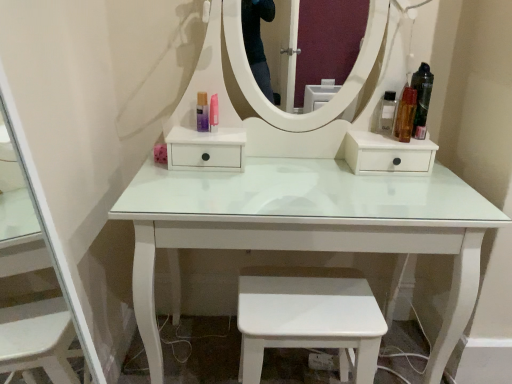
Where is `shiny black hair spray at upper right, which ranks as the 1th toiletry in right-to-left order`? The image size is (512, 384). shiny black hair spray at upper right, which ranks as the 1th toiletry in right-to-left order is located at coordinates (422, 99).

Where is `translucent purple bottle at center, arranged as the 5th toiletry when viewed from the right`? The width and height of the screenshot is (512, 384). translucent purple bottle at center, arranged as the 5th toiletry when viewed from the right is located at coordinates (202, 112).

Find the location of `shiny black hair spray at upper right, which is the 5th toiletry in left-to-right order`. shiny black hair spray at upper right, which is the 5th toiletry in left-to-right order is located at coordinates point(422,99).

Are translucent amber bottle at right, which appears as the 4th toiletry when viewed from the left, and translucent purple bottle at center, arranged as the 5th toiletry when viewed from the right, far apart?

No, translucent amber bottle at right, which appears as the 4th toiletry when viewed from the left, is in close proximity to translucent purple bottle at center, arranged as the 5th toiletry when viewed from the right.

From a real-world perspective, starting from the translucent amber bottle at right, the 2th toiletry viewed from the right, which toiletry is the 2nd one below it? Please provide its 2D coordinates.

[(202, 112)]

Is translucent purple bottle at center, arranged as the first toiletry when viewed from the left, a part of translucent amber bottle at right, which appears as the 4th toiletry when viewed from the left?

That's incorrect, translucent purple bottle at center, arranged as the first toiletry when viewed from the left, is not inside translucent amber bottle at right, which appears as the 4th toiletry when viewed from the left.

Consider the image. Considering the sizes of objects shiny black hair spray at upper right, which ranks as the 1th toiletry in right-to-left order, and translucent purple bottle at center, arranged as the first toiletry when viewed from the left, in the image provided, who is thinner, shiny black hair spray at upper right, which ranks as the 1th toiletry in right-to-left order, or translucent purple bottle at center, arranged as the first toiletry when viewed from the left,?

translucent purple bottle at center, arranged as the first toiletry when viewed from the left, is thinner.

Considering the points (430, 78) and (198, 109), which point is in front, point (430, 78) or point (198, 109)?

Point (430, 78)

Is shiny black hair spray at upper right, which is the 5th toiletry in left-to-right order, taller than translucent purple bottle at center, arranged as the 5th toiletry when viewed from the right?

Indeed, shiny black hair spray at upper right, which is the 5th toiletry in left-to-right order, has a greater height compared to translucent purple bottle at center, arranged as the 5th toiletry when viewed from the right.

Considering the relative positions of shiny black hair spray at upper right, which ranks as the 1th toiletry in right-to-left order, and translucent purple bottle at center, arranged as the first toiletry when viewed from the left, in the image provided, is shiny black hair spray at upper right, which ranks as the 1th toiletry in right-to-left order, in front of translucent purple bottle at center, arranged as the first toiletry when viewed from the left,?

Yes.

Is satin silver spray can at right, the 3th toiletry when ordered from right to left, not close to pink glossy lipstick at center, which is counted as the 2th toiletry, starting from the left?

No, satin silver spray can at right, the 3th toiletry when ordered from right to left, is not far away from pink glossy lipstick at center, which is counted as the 2th toiletry, starting from the left.

Considering the points (386, 98) and (211, 118), which point is in front, point (386, 98) or point (211, 118)?

The point (211, 118) is closer.

From the image's perspective, which one is positioned higher, satin silver spray can at right, which appears as the third toiletry when viewed from the left, or pink glossy lipstick at center, which is the fourth toiletry in right-to-left order?

satin silver spray can at right, which appears as the third toiletry when viewed from the left, is shown above in the image.

Can you tell me how much satin silver spray can at right, which appears as the third toiletry when viewed from the left, and pink glossy lipstick at center, which is counted as the 2th toiletry, starting from the left, differ in facing direction?

satin silver spray can at right, which appears as the third toiletry when viewed from the left, and pink glossy lipstick at center, which is counted as the 2th toiletry, starting from the left, are facing 0.000184 degrees away from each other.

Between translucent purple bottle at center, arranged as the first toiletry when viewed from the left, and satin silver spray can at right, the 3th toiletry when ordered from right to left, which one has less height?

Standing shorter between the two is translucent purple bottle at center, arranged as the first toiletry when viewed from the left.

Visually, is translucent purple bottle at center, arranged as the 5th toiletry when viewed from the right, positioned to the left or to the right of satin silver spray can at right, the 3th toiletry when ordered from right to left?

In the image, translucent purple bottle at center, arranged as the 5th toiletry when viewed from the right, appears on the left side of satin silver spray can at right, the 3th toiletry when ordered from right to left.

From the picture: Is translucent purple bottle at center, arranged as the first toiletry when viewed from the left, oriented away from satin silver spray can at right, the 3th toiletry when ordered from right to left?

translucent purple bottle at center, arranged as the first toiletry when viewed from the left, does not have its back to satin silver spray can at right, the 3th toiletry when ordered from right to left.

This screenshot has height=384, width=512. Find the location of `the 1st toiletry positioned below the satin silver spray can at right, the 3th toiletry when ordered from right to left (from a real-world perspective)`. the 1st toiletry positioned below the satin silver spray can at right, the 3th toiletry when ordered from right to left (from a real-world perspective) is located at coordinates (202, 112).

In the image, is pink glossy lipstick at center, which is counted as the 2th toiletry, starting from the left, positioned in front of or behind translucent amber bottle at right, the 2th toiletry viewed from the right?

pink glossy lipstick at center, which is counted as the 2th toiletry, starting from the left, is positioned farther from the viewer than translucent amber bottle at right, the 2th toiletry viewed from the right.

Consider the image. How many degrees apart are the facing directions of pink glossy lipstick at center, which is counted as the 2th toiletry, starting from the left, and translucent amber bottle at right, which appears as the 4th toiletry when viewed from the left?

The facing directions of pink glossy lipstick at center, which is counted as the 2th toiletry, starting from the left, and translucent amber bottle at right, which appears as the 4th toiletry when viewed from the left, are 0.00157 degrees apart.

From the image's perspective, between pink glossy lipstick at center, which is counted as the 2th toiletry, starting from the left, and translucent amber bottle at right, which appears as the 4th toiletry when viewed from the left, which one is located above?

pink glossy lipstick at center, which is counted as the 2th toiletry, starting from the left, from the image's perspective.

Is point (215, 111) behind point (411, 110)?

Yes, point (215, 111) is behind point (411, 110).

In the image, there is a translucent purple bottle at center, arranged as the 5th toiletry when viewed from the right. Identify the location of toiletry below it (from a real-world perspective). Image resolution: width=512 pixels, height=384 pixels. (214, 113).

Considering the sizes of pink glossy lipstick at center, which is counted as the 2th toiletry, starting from the left, and translucent purple bottle at center, arranged as the first toiletry when viewed from the left, in the image, is pink glossy lipstick at center, which is counted as the 2th toiletry, starting from the left, bigger or smaller than translucent purple bottle at center, arranged as the first toiletry when viewed from the left,?

Considering their sizes, pink glossy lipstick at center, which is counted as the 2th toiletry, starting from the left, takes up less space than translucent purple bottle at center, arranged as the first toiletry when viewed from the left.

Is pink glossy lipstick at center, which is the fourth toiletry in right-to-left order, far from translucent purple bottle at center, arranged as the first toiletry when viewed from the left?

pink glossy lipstick at center, which is the fourth toiletry in right-to-left order, is actually quite close to translucent purple bottle at center, arranged as the first toiletry when viewed from the left.

Which is further, (x=209, y=115) or (x=203, y=99)?

The point (x=203, y=99) is more distant.

Measure the distance between shiny black hair spray at upper right, which ranks as the 1th toiletry in right-to-left order, and satin silver spray can at right, the 3th toiletry when ordered from right to left.

shiny black hair spray at upper right, which ranks as the 1th toiletry in right-to-left order, is 10.50 centimeters away from satin silver spray can at right, the 3th toiletry when ordered from right to left.

Considering the sizes of objects shiny black hair spray at upper right, which is the 5th toiletry in left-to-right order, and satin silver spray can at right, the 3th toiletry when ordered from right to left, in the image provided, who is taller, shiny black hair spray at upper right, which is the 5th toiletry in left-to-right order, or satin silver spray can at right, the 3th toiletry when ordered from right to left,?

With more height is shiny black hair spray at upper right, which is the 5th toiletry in left-to-right order.

Identify the location of the 2nd toiletry directly beneath the shiny black hair spray at upper right, which is the 5th toiletry in left-to-right order (from a real-world perspective). This screenshot has width=512, height=384. click(388, 112).

The width and height of the screenshot is (512, 384). I want to click on the 3rd toiletry to the left of the translucent amber bottle at right, the 2th toiletry viewed from the right, counting from the anchor's position, so (x=202, y=112).

At what (x,y) coordinates should I click in order to perform the action: click on the 2nd toiletry in front of the translucent purple bottle at center, arranged as the first toiletry when viewed from the left. Please return your answer as a coordinate pair (x, y). Looking at the image, I should click on (422, 99).

When comparing their distances from translucent purple bottle at center, arranged as the 5th toiletry when viewed from the right, does white glossy step stool at lower center or pink glossy lipstick at center, which is the fourth toiletry in right-to-left order, seem further?

white glossy step stool at lower center is further to translucent purple bottle at center, arranged as the 5th toiletry when viewed from the right.

From the image, which object appears to be farther from translucent amber bottle at right, the 2th toiletry viewed from the right, white glossy step stool at lower center or shiny black hair spray at upper right, which is the 5th toiletry in left-to-right order?

Based on the image, white glossy step stool at lower center appears to be further to translucent amber bottle at right, the 2th toiletry viewed from the right.

From the image, which object appears to be farther from pink glossy lipstick at center, which is the fourth toiletry in right-to-left order, translucent purple bottle at center, arranged as the first toiletry when viewed from the left, or shiny black hair spray at upper right, which ranks as the 1th toiletry in right-to-left order?

shiny black hair spray at upper right, which ranks as the 1th toiletry in right-to-left order, is positioned further to the anchor pink glossy lipstick at center, which is the fourth toiletry in right-to-left order.

From the picture: Based on their spatial positions, is shiny black hair spray at upper right, which ranks as the 1th toiletry in right-to-left order, or pink glossy lipstick at center, which is the fourth toiletry in right-to-left order, further from translucent purple bottle at center, arranged as the 5th toiletry when viewed from the right?

Among the two, shiny black hair spray at upper right, which ranks as the 1th toiletry in right-to-left order, is located further to translucent purple bottle at center, arranged as the 5th toiletry when viewed from the right.

Looking at the image, which one is located closer to translucent purple bottle at center, arranged as the first toiletry when viewed from the left, pink glossy lipstick at center, which is the fourth toiletry in right-to-left order, or white glossy step stool at lower center?

The object closer to translucent purple bottle at center, arranged as the first toiletry when viewed from the left, is pink glossy lipstick at center, which is the fourth toiletry in right-to-left order.

From the image, which object appears to be farther from satin silver spray can at right, the 3th toiletry when ordered from right to left, translucent amber bottle at right, which appears as the 4th toiletry when viewed from the left, or white glossy step stool at lower center?

white glossy step stool at lower center is positioned further to the anchor satin silver spray can at right, the 3th toiletry when ordered from right to left.

Looking at the image, which one is located closer to white glossy step stool at lower center, satin silver spray can at right, which appears as the third toiletry when viewed from the left, or translucent purple bottle at center, arranged as the 5th toiletry when viewed from the right?

Among the two, translucent purple bottle at center, arranged as the 5th toiletry when viewed from the right, is located nearer to white glossy step stool at lower center.

Based on the photo, considering their positions, is shiny black hair spray at upper right, which is the 5th toiletry in left-to-right order, positioned closer to pink glossy lipstick at center, which is counted as the 2th toiletry, starting from the left, than satin silver spray can at right, the 3th toiletry when ordered from right to left?

satin silver spray can at right, the 3th toiletry when ordered from right to left.

Locate an element on the screen. The height and width of the screenshot is (384, 512). toiletry between pink glossy lipstick at center, which is counted as the 2th toiletry, starting from the left, and white glossy step stool at lower center vertically is located at coordinates (406, 115).

Image resolution: width=512 pixels, height=384 pixels. Identify the location of toiletry between pink glossy lipstick at center, which is the fourth toiletry in right-to-left order, and translucent amber bottle at right, the 2th toiletry viewed from the right, in the horizontal direction. (388, 112).

Locate an element on the screen. toiletry between satin silver spray can at right, which appears as the third toiletry when viewed from the left, and shiny black hair spray at upper right, which is the 5th toiletry in left-to-right order, from left to right is located at coordinates (406, 115).

In order to click on toiletry between translucent purple bottle at center, arranged as the 5th toiletry when viewed from the right, and satin silver spray can at right, which appears as the third toiletry when viewed from the left in this screenshot , I will do `click(214, 113)`.